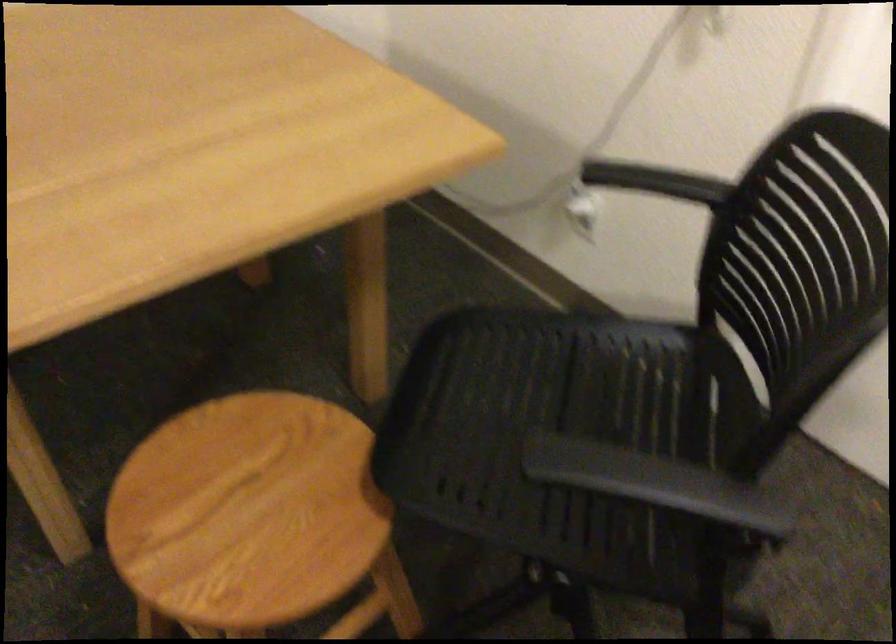
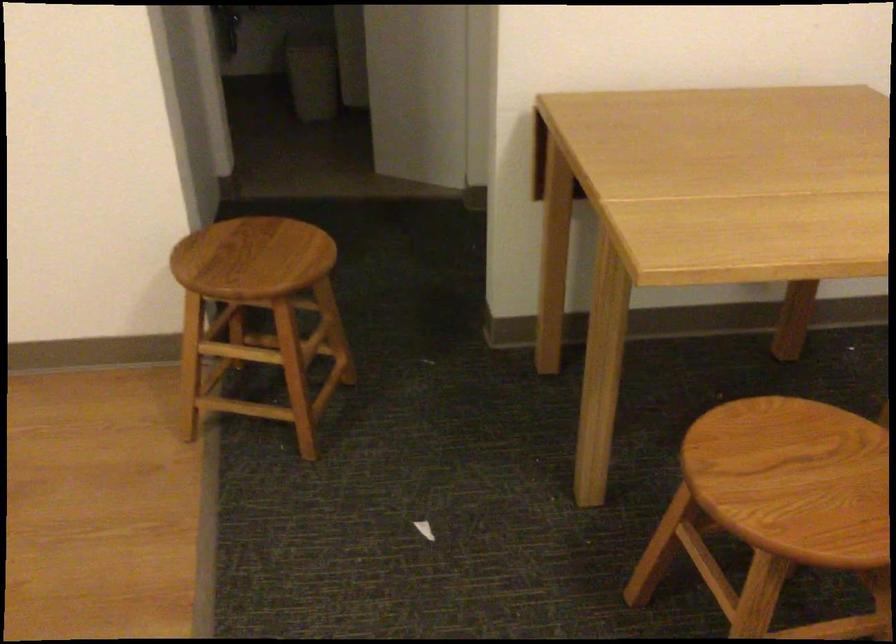
In the second image, find the point that corresponds to point 264,489 in the first image.

(807, 476)